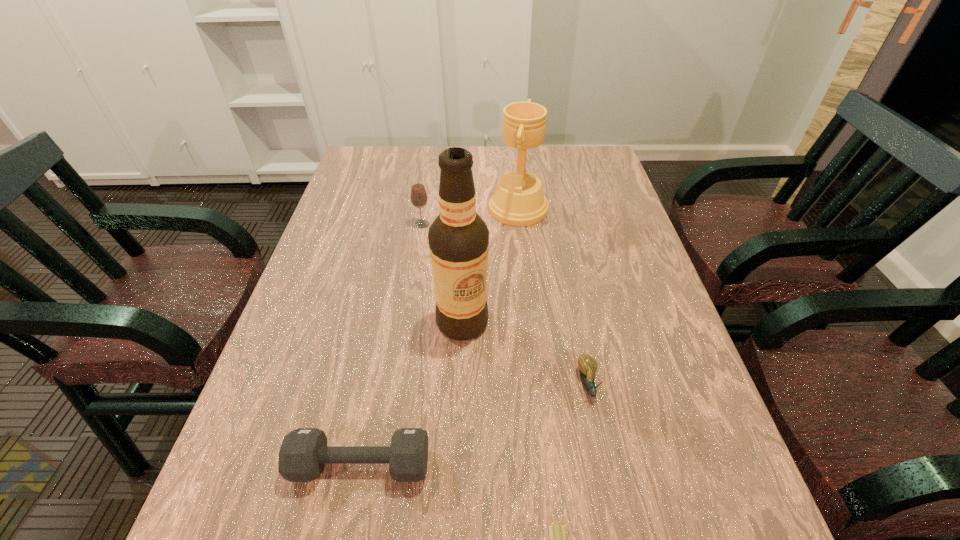
You are a GUI agent. You are given a task and a screenshot of the screen. Output one action in this format:
    pyautogui.click(x=<x>, y=<y>)
    Task: Click on the tallest object
    This screenshot has width=960, height=540.
    Given the screenshot: What is the action you would take?
    pyautogui.click(x=458, y=238)

Locate an element on the screen. The image size is (960, 540). alcohol is located at coordinates (458, 238).

At what (x,y) coordinates should I click in order to perform the action: click on award. Please return your answer as a coordinate pair (x, y). Looking at the image, I should click on (518, 200).

Find the location of a particular element. The height and width of the screenshot is (540, 960). glass drink container is located at coordinates (418, 193).

You are a GUI agent. You are given a task and a screenshot of the screen. Output one action in this format:
    pyautogui.click(x=<x>, y=<y>)
    Task: Click on the dumbbell
    The height and width of the screenshot is (540, 960).
    Given the screenshot: What is the action you would take?
    pyautogui.click(x=304, y=452)

Where is `the second nearest object`? the second nearest object is located at coordinates (304, 452).

Where is `the farther escargot`? The height and width of the screenshot is (540, 960). the farther escargot is located at coordinates (588, 365).

What are the coordinates of `the third nearest object` in the screenshot? It's located at (588, 365).

Identify the location of blank area located on the label of the third farthest object. Image resolution: width=960 pixels, height=540 pixels. (459, 406).

Locate an element on the screen. Image resolution: width=960 pixels, height=540 pixels. free region located 0.110m on the front of the award is located at coordinates (523, 258).